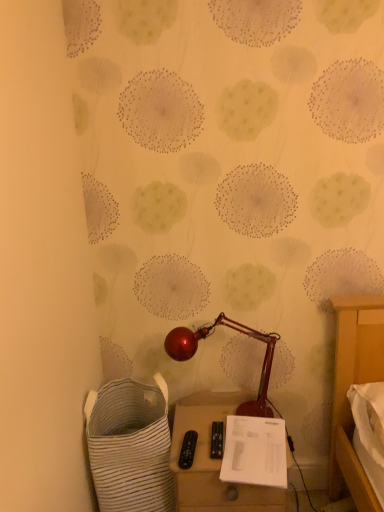
In order to face shiny metallic lamp at center, should I rotate leftwards or rightwards?

Turn right by 3.977 degrees to look at shiny metallic lamp at center.

This screenshot has width=384, height=512. Describe the element at coordinates (130, 446) in the screenshot. I see `white striped fabric laundry basket at lower left` at that location.

Describe the element at coordinates (213, 460) in the screenshot. The image size is (384, 512). I see `matte beige side table at lower center` at that location.

What do you see at coordinates (255, 451) in the screenshot? I see `white paper at lower center` at bounding box center [255, 451].

Identify the location of shiny metallic lamp at center. This screenshot has height=512, width=384. (238, 331).

Consider the image. Could you measure the distance between white striped fabric laundry basket at lower left and matte beige side table at lower center?

A distance of 7.20 inches exists between white striped fabric laundry basket at lower left and matte beige side table at lower center.

Is white striped fabric laundry basket at lower left shorter than matte beige side table at lower center?

No, white striped fabric laundry basket at lower left is not shorter than matte beige side table at lower center.

Which is behind, point (141, 504) or point (182, 417)?

Point (182, 417)

Are shiny metallic lamp at center and white striped fabric laundry basket at lower left located far from each other?

No, there isn't a large distance between shiny metallic lamp at center and white striped fabric laundry basket at lower left.

From the image's perspective, which object appears higher, shiny metallic lamp at center or white striped fabric laundry basket at lower left?

shiny metallic lamp at center, from the image's perspective.

Considering the positions of objects shiny metallic lamp at center and white striped fabric laundry basket at lower left in the image provided, who is more to the left, shiny metallic lamp at center or white striped fabric laundry basket at lower left?

white striped fabric laundry basket at lower left.

Between point (261, 415) and point (154, 475), which one is positioned behind?

Point (261, 415)

Which of these two, shiny metallic lamp at center or white paper at lower center, is thinner?

shiny metallic lamp at center is thinner.

Considering the positions of objects shiny metallic lamp at center and white paper at lower center in the image provided, who is more to the right, shiny metallic lamp at center or white paper at lower center?

From the viewer's perspective, white paper at lower center appears more on the right side.

Which of these two, shiny metallic lamp at center or white paper at lower center, is bigger?

Bigger between the two is shiny metallic lamp at center.

Is shiny metallic lamp at center taller or shorter than white paper at lower center?

shiny metallic lamp at center is taller than white paper at lower center.

Based on their positions, is matte beige side table at lower center located to the left or right of white striped fabric laundry basket at lower left?

Clearly, matte beige side table at lower center is on the right of white striped fabric laundry basket at lower left in the image.

From the image's perspective, relative to white striped fabric laundry basket at lower left, is matte beige side table at lower center above or below?

matte beige side table at lower center is situated lower than white striped fabric laundry basket at lower left in the image.

Between matte beige side table at lower center and white striped fabric laundry basket at lower left, which one has more height?

white striped fabric laundry basket at lower left is taller.

Looking at the image, does matte beige side table at lower center seem bigger or smaller compared to white striped fabric laundry basket at lower left?

In the image, matte beige side table at lower center appears to be smaller than white striped fabric laundry basket at lower left.

Do you think matte beige side table at lower center is within white paper at lower center, or outside of it?

The correct answer is: outside.

From the image's perspective, is matte beige side table at lower center on top of white paper at lower center?

No, from the image's perspective, matte beige side table at lower center is not above white paper at lower center.

Based on the photo, considering the sizes of objects matte beige side table at lower center and white paper at lower center in the image provided, who is shorter, matte beige side table at lower center or white paper at lower center?

Standing shorter between the two is white paper at lower center.

Where is `laundry basket that is under the white paper at lower center (from a real-world perspective)`? laundry basket that is under the white paper at lower center (from a real-world perspective) is located at coordinates (130, 446).

From the image's perspective, which one is positioned lower, white paper at lower center or white striped fabric laundry basket at lower left?

From the image's view, white striped fabric laundry basket at lower left is below.

Is white paper at lower center at the right side of white striped fabric laundry basket at lower left?

Yes.

Is white paper at lower center aimed at white striped fabric laundry basket at lower left?

No, white paper at lower center does not turn towards white striped fabric laundry basket at lower left.

Based on their positions, is shiny metallic lamp at center located to the left or right of matte beige side table at lower center?

Based on their positions, shiny metallic lamp at center is located to the left of matte beige side table at lower center.

Find the location of a particular element. Image resolution: width=384 pixels, height=512 pixels. lamp positioned vertically above the matte beige side table at lower center (from a real-world perspective) is located at coordinates (238, 331).

Is shiny metallic lamp at center beside matte beige side table at lower center?

No, shiny metallic lamp at center is not making contact with matte beige side table at lower center.

From the image's perspective, does shiny metallic lamp at center appear higher than matte beige side table at lower center?

Indeed, from the image's perspective, shiny metallic lamp at center is shown above matte beige side table at lower center.

This screenshot has height=512, width=384. Identify the location of furniture that appears behind the white striped fabric laundry basket at lower left. (213, 460).

The height and width of the screenshot is (512, 384). What are the coordinates of `lamp on the right of white striped fabric laundry basket at lower left` in the screenshot? It's located at (238, 331).

Looking at the image, which one is located closer to white striped fabric laundry basket at lower left, white paper at lower center or shiny metallic lamp at center?

white paper at lower center is closer to white striped fabric laundry basket at lower left.

In the scene shown: Based on their spatial positions, is shiny metallic lamp at center or white striped fabric laundry basket at lower left closer to white paper at lower center?

Based on the image, shiny metallic lamp at center appears to be nearer to white paper at lower center.

Based on their spatial positions, is shiny metallic lamp at center or white paper at lower center closer to white striped fabric laundry basket at lower left?

Based on the image, white paper at lower center appears to be nearer to white striped fabric laundry basket at lower left.

In the scene shown: Considering their positions, is white paper at lower center positioned further to matte beige side table at lower center than white striped fabric laundry basket at lower left?

The object further to matte beige side table at lower center is white striped fabric laundry basket at lower left.

From the image, which object appears to be farther from shiny metallic lamp at center, white striped fabric laundry basket at lower left or white paper at lower center?

white striped fabric laundry basket at lower left is further to shiny metallic lamp at center.

Based on their spatial positions, is shiny metallic lamp at center or white paper at lower center further from matte beige side table at lower center?

Based on the image, shiny metallic lamp at center appears to be further to matte beige side table at lower center.

When comparing their distances from shiny metallic lamp at center, does white striped fabric laundry basket at lower left or matte beige side table at lower center seem further?

white striped fabric laundry basket at lower left lies further to shiny metallic lamp at center than the other object.

From the image, which object appears to be nearer to matte beige side table at lower center, white striped fabric laundry basket at lower left or shiny metallic lamp at center?

white striped fabric laundry basket at lower left lies closer to matte beige side table at lower center than the other object.

What are the coordinates of `laundry basket between shiny metallic lamp at center and matte beige side table at lower center in the vertical direction` in the screenshot? It's located at (130, 446).

Find the location of a particular element. lamp between white striped fabric laundry basket at lower left and white paper at lower center from left to right is located at coordinates (238, 331).

Image resolution: width=384 pixels, height=512 pixels. What are the coordinates of `furniture situated between white striped fabric laundry basket at lower left and white paper at lower center from left to right` in the screenshot? It's located at (213, 460).

Where is `notepad between shiny metallic lamp at center and matte beige side table at lower center from top to bottom`? Image resolution: width=384 pixels, height=512 pixels. notepad between shiny metallic lamp at center and matte beige side table at lower center from top to bottom is located at coordinates point(255,451).